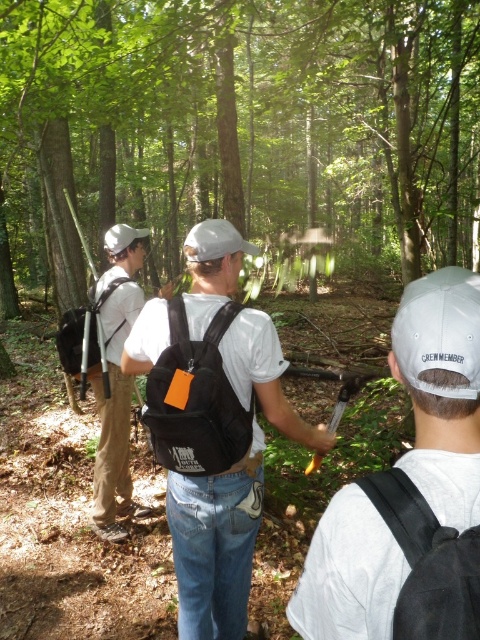
Does green leafy tree at center have a greater width compared to white fabric cap at center?

Indeed, green leafy tree at center has a greater width compared to white fabric cap at center.

Can you confirm if green leafy tree at center is positioned to the right of white fabric cap at center?

Incorrect, green leafy tree at center is not on the right side of white fabric cap at center.

What do you see at coordinates (239, 132) in the screenshot? I see `green leafy tree at center` at bounding box center [239, 132].

This screenshot has height=640, width=480. I want to click on green leafy tree at center, so click(239, 132).

Which is behind, point (379, 620) or point (417, 355)?

Point (417, 355)

Locate an element on the screen. This screenshot has height=640, width=480. white matte baseball cap at center is located at coordinates (442, 388).

Does matte black backpack at left have a greater height compared to white matte baseball hat at upper left?

In fact, matte black backpack at left may be shorter than white matte baseball hat at upper left.

Is matte black backpack at left bigger than white matte baseball hat at upper left?

Actually, matte black backpack at left might be smaller than white matte baseball hat at upper left.

Who is more distant from viewer, (98, 440) or (113, 225)?

Positioned behind is point (113, 225).

Find the location of a particular element. This screenshot has width=480, height=640. matte black backpack at left is located at coordinates (117, 384).